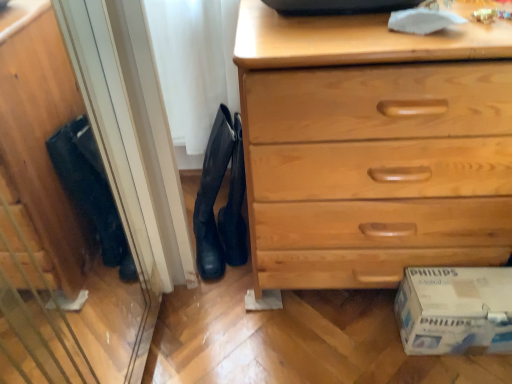
You are a GUI agent. You are given a task and a screenshot of the screen. Output one action in this format:
    pyautogui.click(x=<x>, y=<y>)
    Task: Click on the vacant space situated above white cardboard box at lower right (from a real-world perspective)
    The width and height of the screenshot is (512, 384).
    Given the screenshot: What is the action you would take?
    pyautogui.click(x=465, y=286)